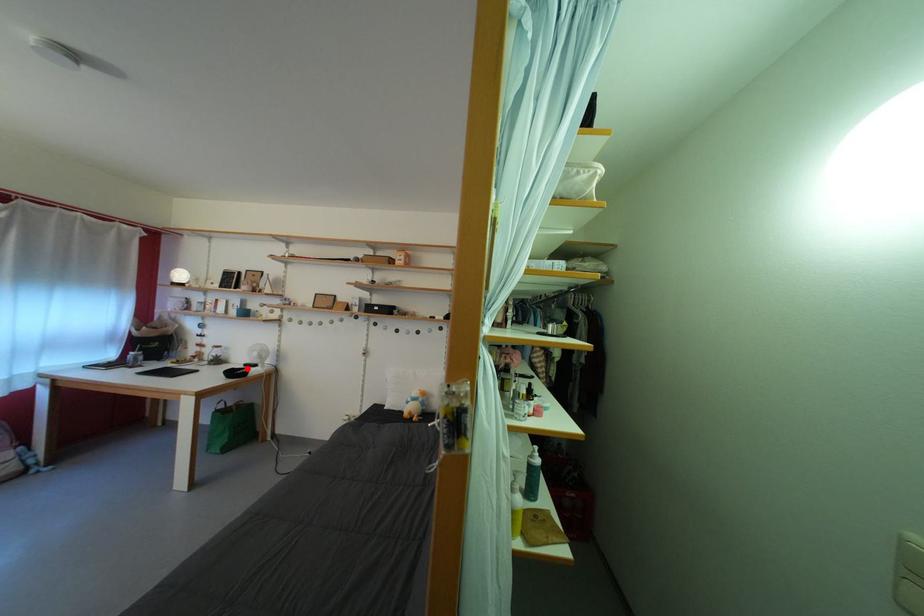
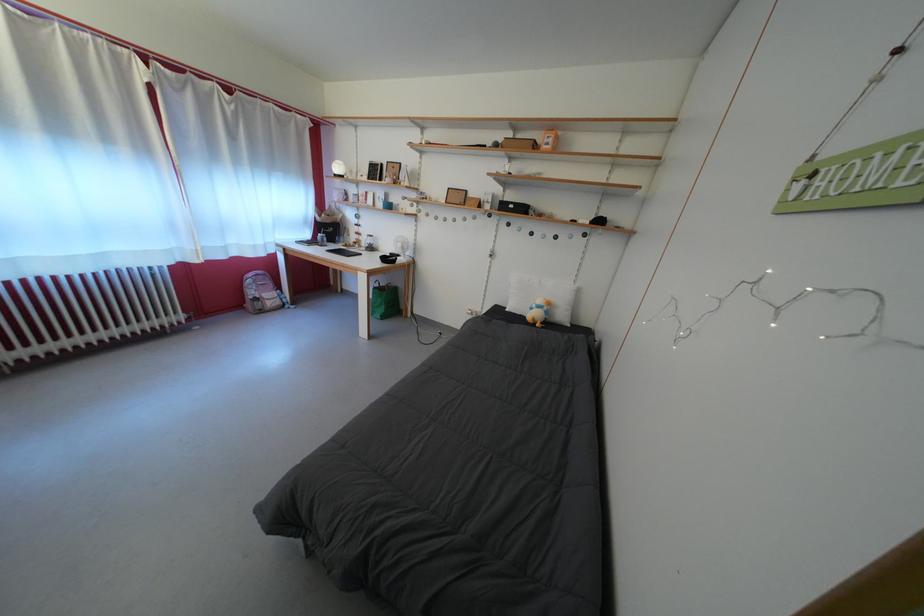
Question: I am providing you with two images of the same scene from different viewpoints. Given a red point in image1, look at the same physical point in image2. Is it:

Choices:
 (A) Closer to the viewpoint
 (B) Farther from the viewpoint

Answer: (A)